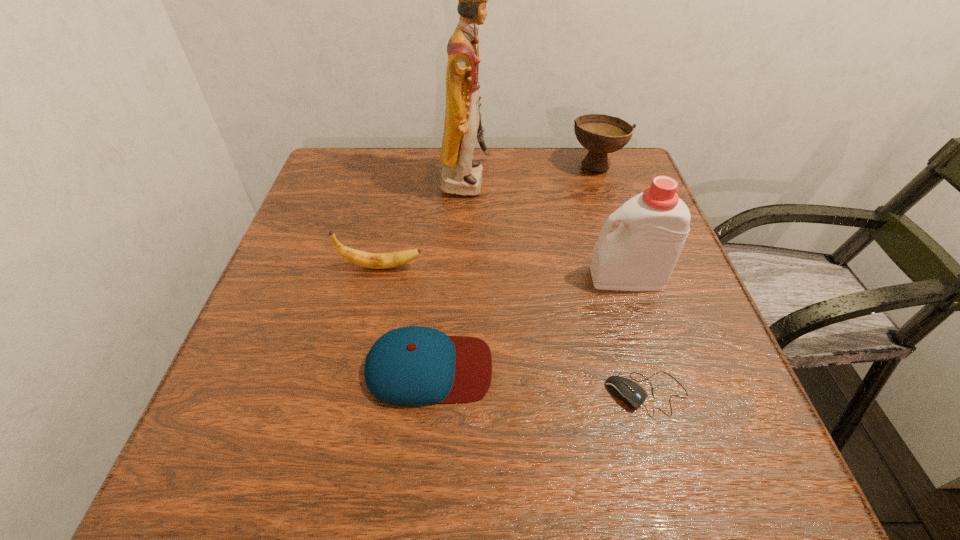
Identify the location of object at the far right corner. (601, 134).

In the image, there is a desktop. In order to click on free region at the far edge in this screenshot , I will do `click(518, 164)`.

Find the location of a particular element. free region at the near edge of the desktop is located at coordinates (316, 467).

I want to click on free region at the left edge of the desktop, so click(266, 372).

Where is `vacant area at the right edge of the desktop`? This screenshot has width=960, height=540. vacant area at the right edge of the desktop is located at coordinates (612, 200).

You are a GUI agent. You are given a task and a screenshot of the screen. Output one action in this format:
    pyautogui.click(x=<x>, y=<y>)
    Task: Click on the vacant space at the far right corner
    Image resolution: width=960 pixels, height=540 pixels.
    Given the screenshot: What is the action you would take?
    pyautogui.click(x=636, y=179)

The height and width of the screenshot is (540, 960). In the image, there is a desktop. In order to click on vacant space at the near right corner in this screenshot , I will do `click(734, 462)`.

I want to click on free space between the detergent and the tallest object, so click(x=546, y=229).

Locate an element on the screen. The image size is (960, 540). unoccupied position between the fifth shortest object and the third shortest object is located at coordinates (504, 272).

At what (x,y) coordinates should I click in order to perform the action: click on vacant space that's between the baseball cap and the fifth shortest object. Please return your answer as a coordinate pair (x, y). This screenshot has width=960, height=540. Looking at the image, I should click on (528, 323).